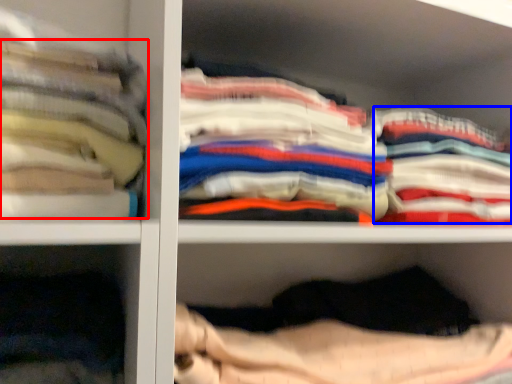
Question: Which object appears farthest to the camera in this image, clothing (highlighted by a red box) or clothing (highlighted by a blue box)?

Choices:
 (A) clothing
 (B) clothing

Answer: (B)